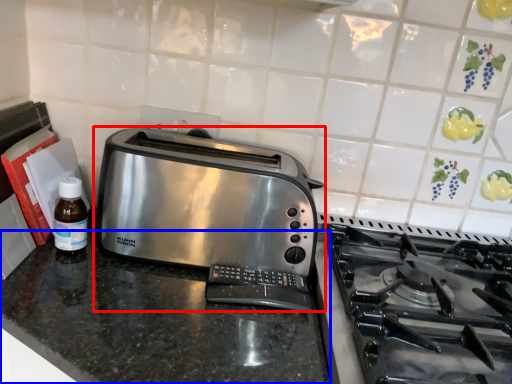
Question: Which point is closer to the camera, toaster (highlighted by a red box) or counter (highlighted by a blue box)?

Choices:
 (A) toaster
 (B) counter

Answer: (B)